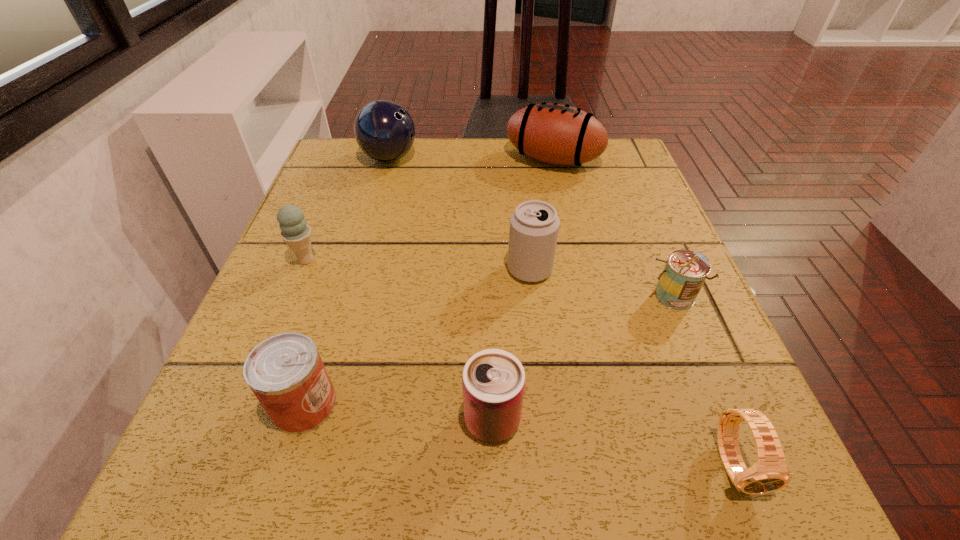
Find the location of a particular element. Image resolution: width=960 pixels, height=540 pixels. bowling ball is located at coordinates (384, 130).

The height and width of the screenshot is (540, 960). I want to click on football (American), so pos(557,134).

What are the coordinates of `ice cream` in the screenshot? It's located at (297, 234).

This screenshot has width=960, height=540. I want to click on the rightmost can, so (x=685, y=271).

In order to click on the leftmost can in this screenshot , I will do `click(285, 372)`.

At what (x,y) coordinates should I click in order to perform the action: click on the shortest object. Please return your answer as a coordinate pair (x, y). Looking at the image, I should click on point(769,473).

What are the coordinates of `vacant space positioned on the surface of the bowling ball near the finger holes` in the screenshot? It's located at (458, 158).

Locate an element on the screen. This screenshot has height=540, width=960. free space located on the front of the football (American) is located at coordinates (571, 243).

Identify the location of vacant region located 0.340m on the back of the ice cream. (348, 160).

Locate an element on the screen. Image resolution: width=960 pixels, height=540 pixels. vacant space located on the back of the rightmost can is located at coordinates (643, 226).